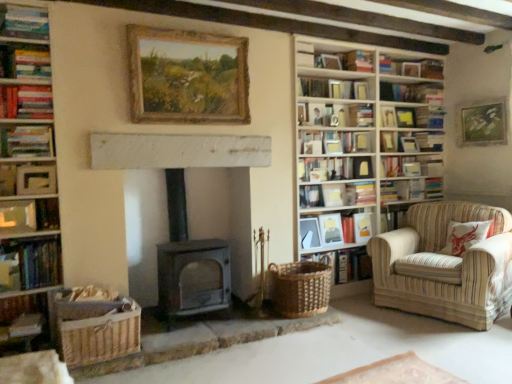
The image size is (512, 384). I want to click on vacant area on top of hardcover books at left, which is counted as the eleventh book, starting from the bottom (from a real-world perspective), so click(25, 44).